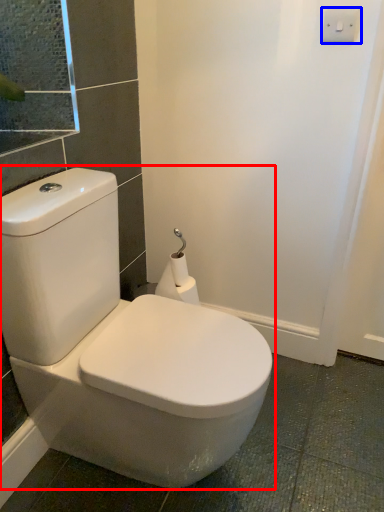
Question: Which point is closer to the camera, toilet (highlighted by a red box) or light switch (highlighted by a blue box)?

Choices:
 (A) toilet
 (B) light switch

Answer: (A)